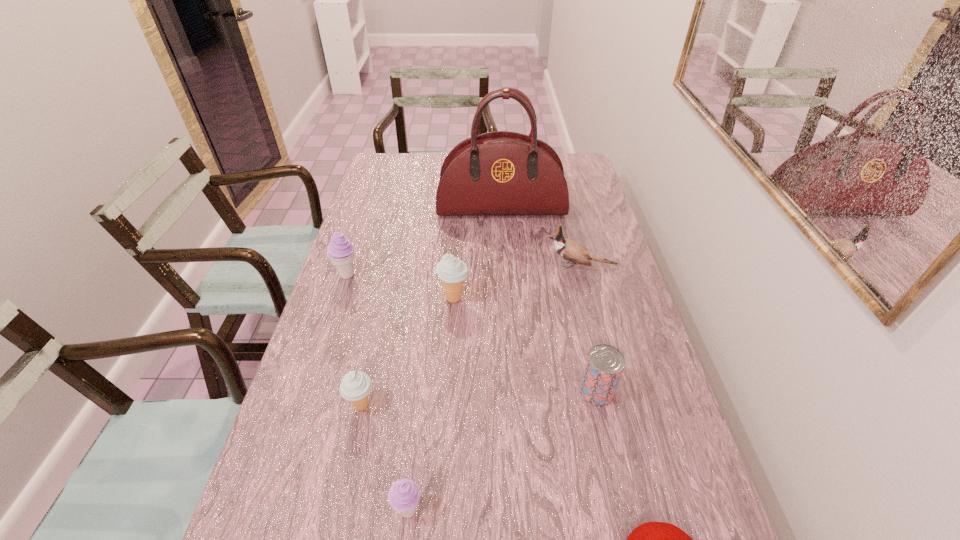
The height and width of the screenshot is (540, 960). I want to click on unoccupied position between the fifth nearest object and the nearest icecream, so click(431, 404).

You are a GUI agent. You are given a task and a screenshot of the screen. Output one action in this format:
    pyautogui.click(x=<x>, y=<y>)
    Task: Click on the vacant space in between the bird and the fifth nearest object
    
    Given the screenshot: What is the action you would take?
    pyautogui.click(x=516, y=282)

I want to click on empty space that is in between the brown handbag and the leftmost object, so click(x=424, y=242).

This screenshot has height=540, width=960. I want to click on vacant region between the nearer beige icecream and the bird, so click(x=471, y=336).

Find the location of a particular element. The image size is (960, 540). blank region between the red beer can and the leftmost icecream is located at coordinates (472, 333).

Find the location of a particular element. The image size is (960, 540). vacant region between the leftmost object and the handbag is located at coordinates (424, 242).

Where is `vacant space that's between the left beige icecream and the bird`? vacant space that's between the left beige icecream and the bird is located at coordinates (471, 336).

Identify which object is the sixth nearest to the nearer purple icecream. Please provide its 2D coordinates. Your answer should be formatted as a tuple, i.e. [(x, y)], where the tuple contains the x and y coordinates of a point satisfying the conditions above.

[(569, 250)]

Identify which object is located as the third nearest to the red beer can. Please provide its 2D coordinates. Your answer should be formatted as a tuple, i.e. [(x, y)], where the tuple contains the x and y coordinates of a point satisfying the conditions above.

[(569, 250)]

The image size is (960, 540). In order to click on icecream that is the third closest one to the beanbag in this screenshot , I will do `click(452, 271)`.